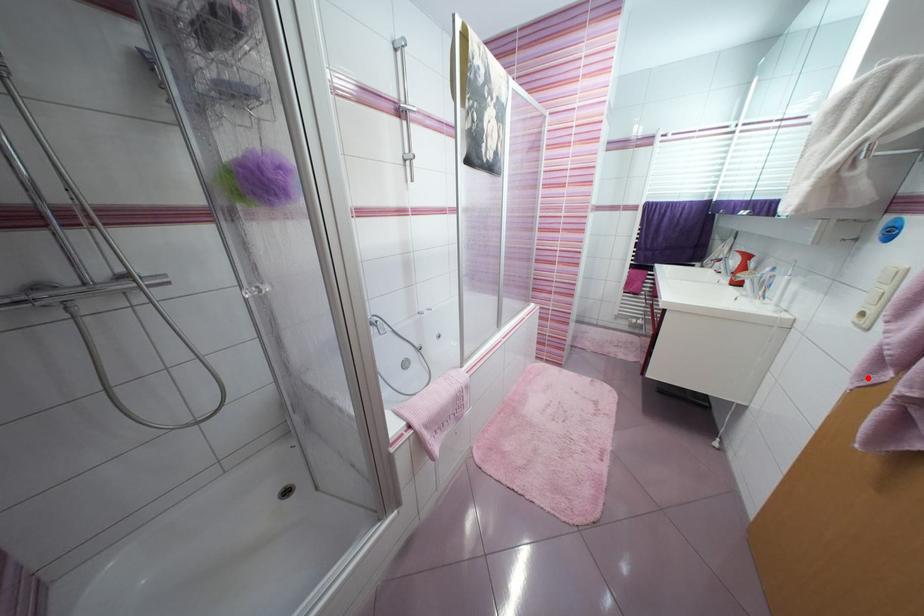
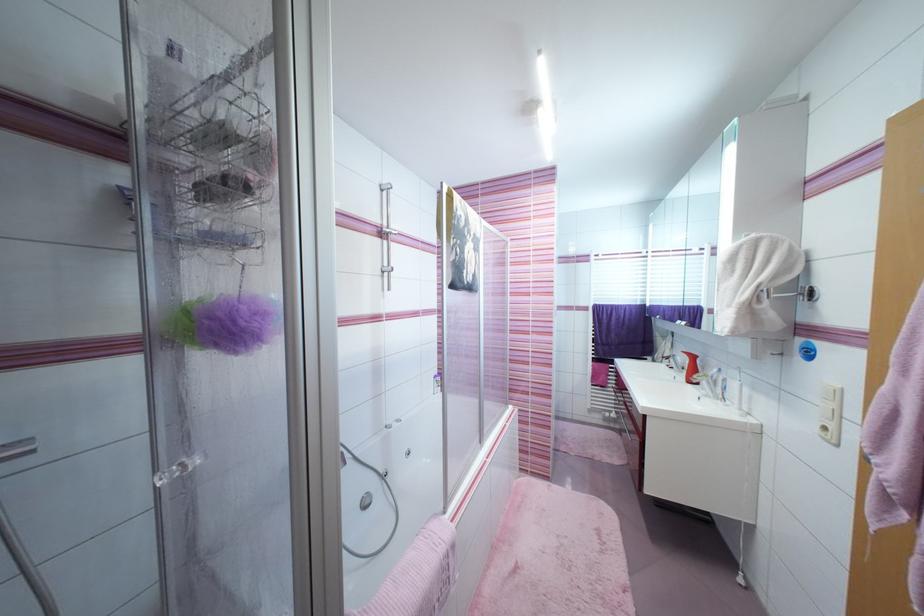
Where in the second image is the point corresponding to the highlighted location from the first image?

(883, 517)